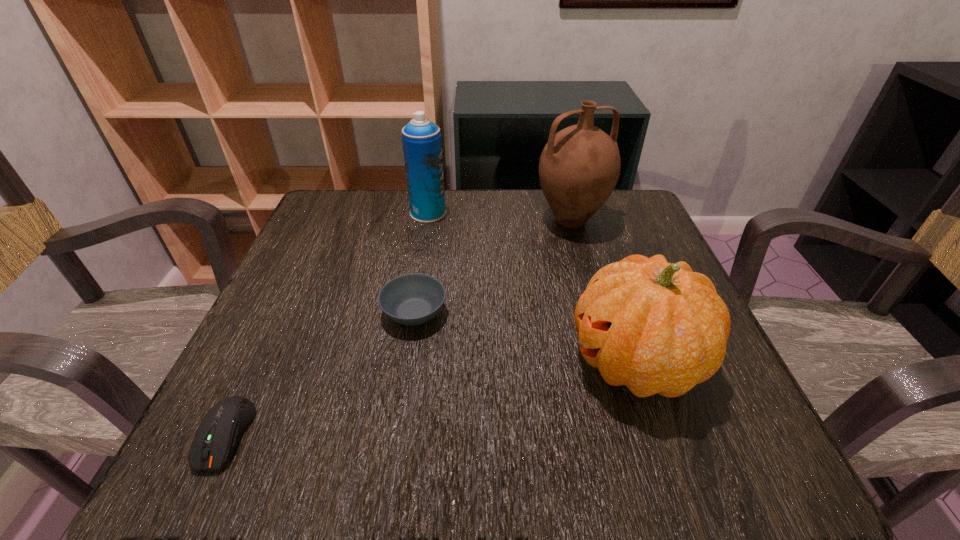
Identify the location of pitcher. (579, 167).

What are the coordinates of `aerosol can` in the screenshot? It's located at (422, 145).

You are a GUI agent. You are given a task and a screenshot of the screen. Output one action in this format:
    pyautogui.click(x=<x>, y=<y>)
    Task: Click on the pumpkin
    
    Given the screenshot: What is the action you would take?
    656,327

Locate an element on the screen. This screenshot has width=960, height=540. soup bowl is located at coordinates [412, 299].

Locate an element on the screen. computer equipment is located at coordinates (222, 427).

This screenshot has height=540, width=960. Identify the location of the shortest object. tap(222, 427).

This screenshot has height=540, width=960. I want to click on vacant position located 0.150m on the front of the pitcher, so click(x=589, y=287).

What are the coordinates of `vacant space situated 0.330m on the right of the aerosol can` in the screenshot? It's located at (583, 213).

Find the location of `free spot located on the carved face of the pumpkin`. free spot located on the carved face of the pumpkin is located at coordinates point(383,362).

At what (x,y) coordinates should I click in order to perform the action: click on vacant space positioned on the carved face of the pumpkin. Please return your answer as a coordinate pair (x, y). The image size is (960, 540). Looking at the image, I should click on (492, 362).